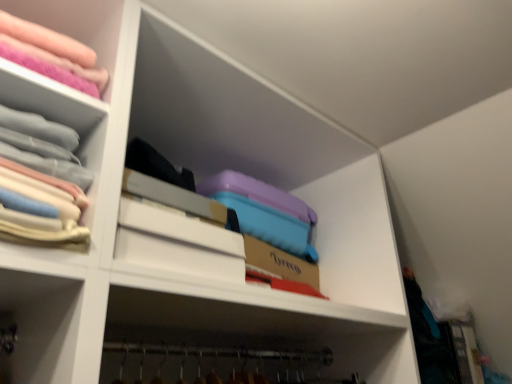
Question: Should I look upward or downward to see pastel fabric stack at upper left?

Choices:
 (A) up
 (B) down

Answer: (A)

Question: Should I look upward or downward to see matte pink fabric at upper left?

Choices:
 (A) up
 (B) down

Answer: (A)

Question: From the image's perspective, is matte pink fabric at upper left over pastel fabric stack at upper left?

Choices:
 (A) no
 (B) yes

Answer: (B)

Question: Could you tell me if matte pink fabric at upper left is facing pastel fabric stack at upper left?

Choices:
 (A) yes
 (B) no

Answer: (B)

Question: Is matte pink fabric at upper left far from pastel fabric stack at upper left?

Choices:
 (A) yes
 (B) no

Answer: (B)

Question: Is matte pink fabric at upper left at the right side of pastel fabric stack at upper left?

Choices:
 (A) yes
 (B) no

Answer: (B)

Question: Can you confirm if matte pink fabric at upper left is wider than pastel fabric stack at upper left?

Choices:
 (A) yes
 (B) no

Answer: (A)

Question: Considering the relative sizes of matte pink fabric at upper left and pastel fabric stack at upper left in the image provided, is matte pink fabric at upper left thinner than pastel fabric stack at upper left?

Choices:
 (A) no
 (B) yes

Answer: (A)

Question: Does pastel fabric stack at upper left appear on the left side of matte pink fabric at upper left?

Choices:
 (A) yes
 (B) no

Answer: (B)

Question: Does pastel fabric stack at upper left have a lesser height compared to matte pink fabric at upper left?

Choices:
 (A) no
 (B) yes

Answer: (A)

Question: Does pastel fabric stack at upper left have a larger size compared to matte pink fabric at upper left?

Choices:
 (A) yes
 (B) no

Answer: (B)

Question: From the image's perspective, is pastel fabric stack at upper left located beneath matte pink fabric at upper left?

Choices:
 (A) yes
 (B) no

Answer: (A)

Question: Is pastel fabric stack at upper left oriented towards matte pink fabric at upper left?

Choices:
 (A) no
 (B) yes

Answer: (A)

Question: From the image's perspective, is pastel fabric stack at upper left over matte pink fabric at upper left?

Choices:
 (A) no
 (B) yes

Answer: (A)

Question: Is point (12, 13) positioned closer to the camera than point (13, 84)?

Choices:
 (A) closer
 (B) farther

Answer: (B)